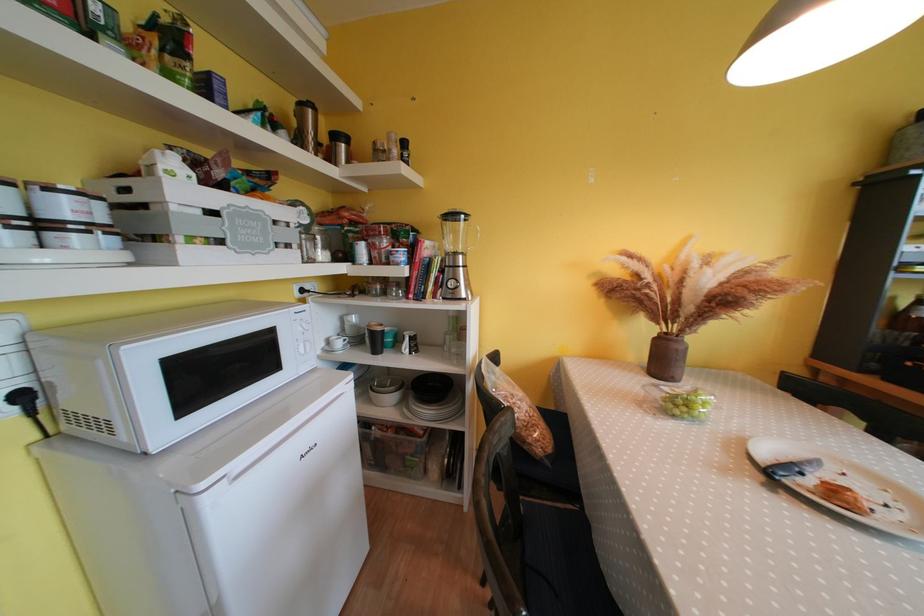
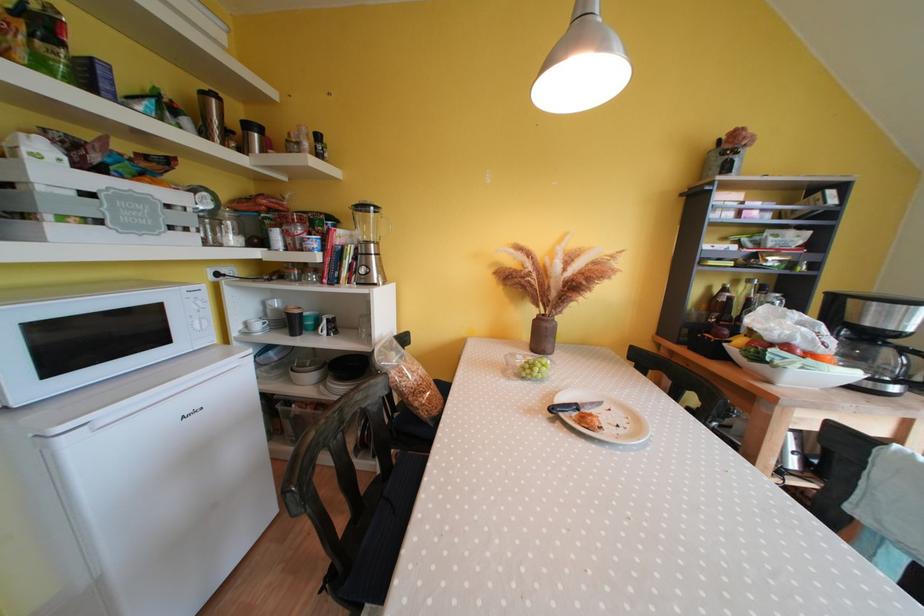
Find the pixel in the second image that matches [298,238] in the first image.

(196, 224)